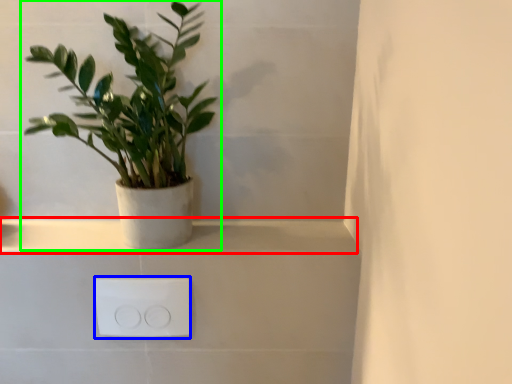
Question: Which is nearer to the window sill (highlighted by a red box)? electric outlet (highlighted by a blue box) or houseplant (highlighted by a green box).

Choices:
 (A) electric outlet
 (B) houseplant

Answer: (A)